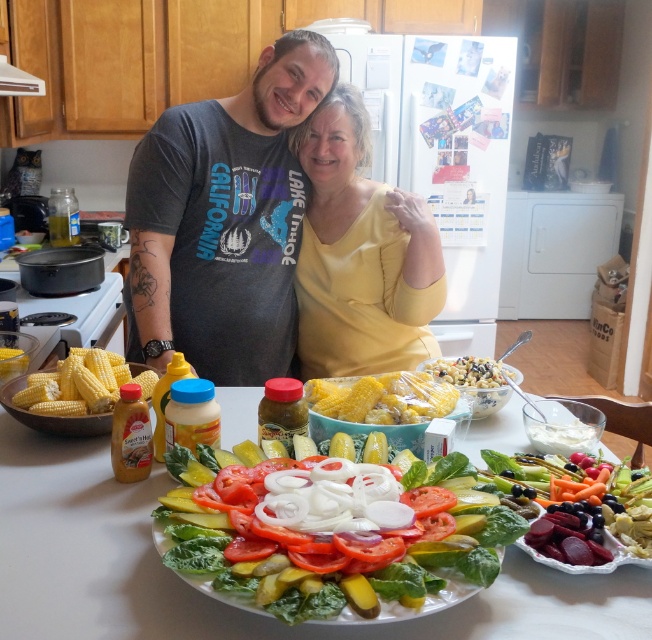
Question: Which point is farther to the camera?

Choices:
 (A) yellow matte shirt at center
 (B) yellow corn at center
 (C) gray cotton t-shirt at center
 (D) fresh green salad at center

Answer: (A)

Question: Is yellow corn at center further to camera compared to yellow matte corn at left?

Choices:
 (A) yes
 (B) no

Answer: (A)

Question: Does yellow matte shirt at center lie behind yellow matte corn at left?

Choices:
 (A) yes
 (B) no

Answer: (A)

Question: Among these points, which one is nearest to the camera?

Choices:
 (A) (151, 371)
 (B) (248, 588)
 (C) (316, 273)

Answer: (B)

Question: Among these objects, which one is nearest to the camera?

Choices:
 (A) yellow matte shirt at center
 (B) yellow corn at center

Answer: (B)

Question: Can you confirm if yellow matte shirt at center is positioned to the right of yellow matte corn at left?

Choices:
 (A) no
 (B) yes

Answer: (B)